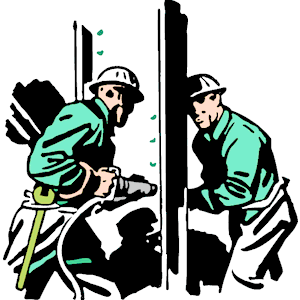
Locate an element on the screen. cord is located at coordinates (68, 224).